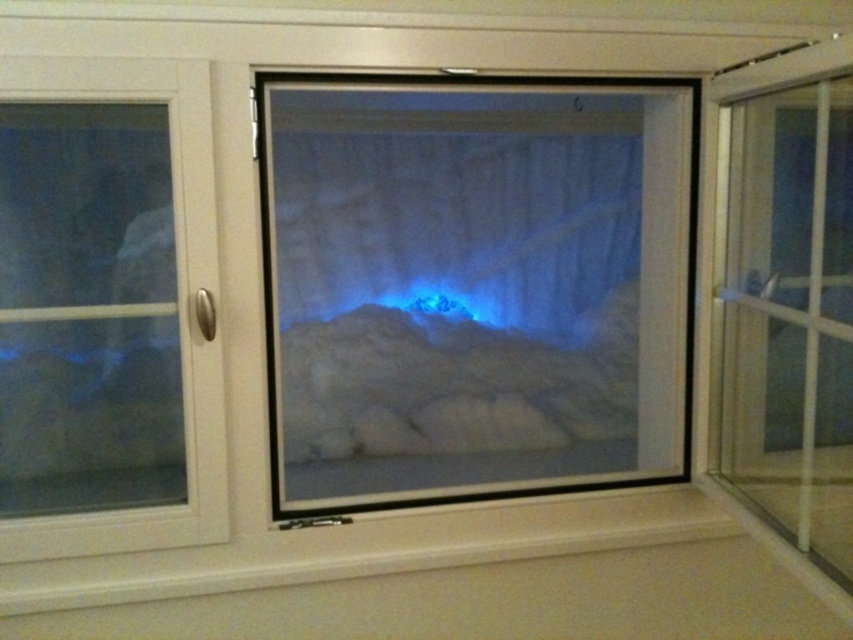
You are trying to exit the room through the glass doors. The transparent glass screen door at center is locked, but the transparent glass door at right is unlocked. Which door should you choose to exit?

You should choose the transparent glass door at right because it is unlocked and accessible for exiting the room.

You are trying to determine which door to use to enter the room. The transparent glass screen door at center and the transparent glass door at right are both options. Based on their sizes, which one would allow a taller person to pass through without bending?

The transparent glass screen door at center is taller than the transparent glass door at right, so a taller person would be able to pass through the transparent glass screen door at center without bending.